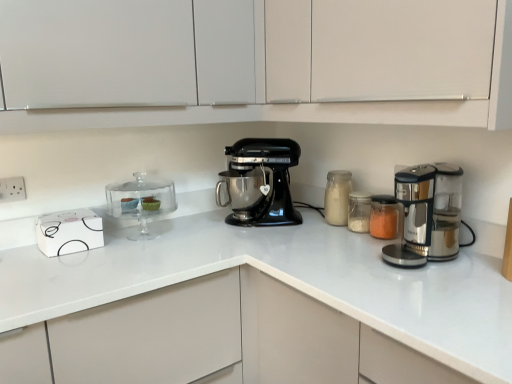
Identify the location of translucent glass jar at center, placed as the 1th appliance when sorted from right to left. (384, 217).

This screenshot has width=512, height=384. Find the location of `black matte mixer at center`. black matte mixer at center is located at coordinates (266, 180).

Describe the element at coordinates (266, 180) in the screenshot. The height and width of the screenshot is (384, 512). I see `black matte mixer at center` at that location.

You are a GUI agent. You are given a task and a screenshot of the screen. Output one action in this format:
    pyautogui.click(x=<x>, y=<y>)
    Task: Click on the translucent glass jar at center, acting as the second appliance starting from the left
    The height and width of the screenshot is (384, 512).
    Given the screenshot: What is the action you would take?
    pyautogui.click(x=359, y=212)

How much space does white matte cabinet at upper center, which is the 1th cabinetry in right-to-left order, occupy vertically?

white matte cabinet at upper center, which is the 1th cabinetry in right-to-left order, is 19.12 inches tall.

What are the coordinates of `translucent glass jar at center-right` in the screenshot? It's located at (337, 197).

Is white plastic electric outlet at upper left to the left or to the right of black matte mixer at center in the image?

white plastic electric outlet at upper left is to the left of black matte mixer at center.

From a real-world perspective, does white plastic electric outlet at upper left stand above black matte mixer at center?

Yes, from a real-world perspective, white plastic electric outlet at upper left is above black matte mixer at center.

Is white plastic electric outlet at upper left oriented towards black matte mixer at center?

No, white plastic electric outlet at upper left is not facing towards black matte mixer at center.

From a real-world perspective, which is physically above, translucent glass jar at center, placed as the 1th appliance when sorted from right to left, or translucent glass jar at center-right?

translucent glass jar at center-right.

Choose the correct answer: Is translucent glass jar at center, placed as the 1th appliance when sorted from right to left, inside translucent glass jar at center-right or outside it?

translucent glass jar at center, placed as the 1th appliance when sorted from right to left, is spatially situated outside translucent glass jar at center-right.

Is point (376, 225) positioned behind point (337, 204)?

No, (376, 225) is closer to viewer.

Does black matte mixer at center appear on the right side of translucent glass jar at center, placed as the 1th appliance when sorted from right to left?

No.

Considering the sizes of black matte mixer at center and translucent glass jar at center, which appears as the third appliance when viewed from the left, in the image, is black matte mixer at center wider or thinner than translucent glass jar at center, which appears as the third appliance when viewed from the left,?

black matte mixer at center is wider than translucent glass jar at center, which appears as the third appliance when viewed from the left.

From a real-world perspective, who is located higher, black matte mixer at center or translucent glass jar at center, placed as the 1th appliance when sorted from right to left?

From a 3D spatial view, black matte mixer at center is above.

From the picture: Can you confirm if black matte mixer at center is smaller than translucent glass jar at center, placed as the 1th appliance when sorted from right to left?

No.

Is white matte cabinet at upper center, which is the 1th cabinetry in right-to-left order, inside or outside of clear glass cake stand at left, the 1th appliance from the left?

white matte cabinet at upper center, which is the 1th cabinetry in right-to-left order, cannot be found inside clear glass cake stand at left, the 1th appliance from the left.

Can you confirm if white matte cabinet at upper center, the second cabinetry positioned from the left, is bigger than clear glass cake stand at left, the 3th appliance in the right-to-left sequence?

Correct, white matte cabinet at upper center, the second cabinetry positioned from the left, is larger in size than clear glass cake stand at left, the 3th appliance in the right-to-left sequence.

Based on their positions, is white matte cabinet at upper center, which is the 1th cabinetry in right-to-left order, located to the left or right of clear glass cake stand at left, the 1th appliance from the left?

Based on their positions, white matte cabinet at upper center, which is the 1th cabinetry in right-to-left order, is located to the right of clear glass cake stand at left, the 1th appliance from the left.

From a real-world perspective, is white matte cabinet at upper center, which is the 1th cabinetry in right-to-left order, over clear glass cake stand at left, the 3th appliance in the right-to-left sequence?

Correct, in the physical world, white matte cabinet at upper center, which is the 1th cabinetry in right-to-left order, is higher than clear glass cake stand at left, the 3th appliance in the right-to-left sequence.

Is white matte cabinet at upper center, which appears as the second cabinetry when viewed from the right, wider or thinner than translucent glass jar at center-right?

Clearly, white matte cabinet at upper center, which appears as the second cabinetry when viewed from the right, has more width compared to translucent glass jar at center-right.

Considering the positions of objects white matte cabinet at upper center, which is the first cabinetry in left-to-right order, and translucent glass jar at center-right in the image provided, who is behind, white matte cabinet at upper center, which is the first cabinetry in left-to-right order, or translucent glass jar at center-right?

Positioned behind is translucent glass jar at center-right.

Is white matte cabinet at upper center, which appears as the second cabinetry when viewed from the right, at the left side of translucent glass jar at center-right?

Yes, white matte cabinet at upper center, which appears as the second cabinetry when viewed from the right, is to the left of translucent glass jar at center-right.

Measure the distance from white matte cabinet at upper center, which is the first cabinetry in left-to-right order, to translucent glass jar at center-right.

white matte cabinet at upper center, which is the first cabinetry in left-to-right order, and translucent glass jar at center-right are 37.04 inches apart from each other.

Is white matte cabinet at upper center, which is the 1th cabinetry in right-to-left order, closer to camera compared to white matte cabinet at upper center, which is the first cabinetry in left-to-right order?

Yes, it is.

Looking at this image, from the image's perspective, which one is positioned higher, white matte cabinet at upper center, the second cabinetry positioned from the left, or white matte cabinet at upper center, which appears as the second cabinetry when viewed from the right?

white matte cabinet at upper center, which appears as the second cabinetry when viewed from the right, is shown above in the image.

Is white matte cabinet at upper center, which is the 1th cabinetry in right-to-left order, bigger than white matte cabinet at upper center, which is the first cabinetry in left-to-right order?

Actually, white matte cabinet at upper center, which is the 1th cabinetry in right-to-left order, might be smaller than white matte cabinet at upper center, which is the first cabinetry in left-to-right order.

How different are the orientations of white matte cabinet at upper center, which is the 1th cabinetry in right-to-left order, and white matte cabinet at upper center, which is the first cabinetry in left-to-right order, in degrees?

There is a 0.145-degree angle between the facing directions of white matte cabinet at upper center, which is the 1th cabinetry in right-to-left order, and white matte cabinet at upper center, which is the first cabinetry in left-to-right order.

From a real-world perspective, does clear glass cake stand at left, the 3th appliance in the right-to-left sequence, stand above white matte cabinet at upper center, the second cabinetry positioned from the left?

Actually, clear glass cake stand at left, the 3th appliance in the right-to-left sequence, is physically below white matte cabinet at upper center, the second cabinetry positioned from the left, in the real world.

Does clear glass cake stand at left, the 3th appliance in the right-to-left sequence, come behind white matte cabinet at upper center, the second cabinetry positioned from the left?

Yes, clear glass cake stand at left, the 3th appliance in the right-to-left sequence, is behind white matte cabinet at upper center, the second cabinetry positioned from the left.

Does clear glass cake stand at left, the 1th appliance from the left, appear on the right side of white matte cabinet at upper center, the second cabinetry positioned from the left?

No.

Considering the sizes of objects clear glass cake stand at left, the 1th appliance from the left, and white matte cabinet at upper center, the second cabinetry positioned from the left, in the image provided, who is bigger, clear glass cake stand at left, the 1th appliance from the left, or white matte cabinet at upper center, the second cabinetry positioned from the left,?

white matte cabinet at upper center, the second cabinetry positioned from the left.

This screenshot has width=512, height=384. What are the coordinates of `mixer located underneath the white plastic electric outlet at upper left (from a real-world perspective)` in the screenshot? It's located at (266, 180).

I want to click on appliance that is the 2nd one when counting rightward from the translucent glass jar at center-right, so click(384, 217).

Estimate the real-world distances between objects in this image. Which object is further from white matte cabinet at upper center, which appears as the second cabinetry when viewed from the right, black matte mixer at center or translucent glass jar at center-right?

translucent glass jar at center-right.

From the image, which object appears to be farther from white plastic electric outlet at upper left, translucent glass jar at center, placed as the second appliance when sorted from right to left, or white matte cabinet at upper center, which is the first cabinetry in left-to-right order?

The object further to white plastic electric outlet at upper left is translucent glass jar at center, placed as the second appliance when sorted from right to left.

Looking at the image, which one is located further to white matte cabinet at upper center, which appears as the second cabinetry when viewed from the right, clear glass cake stand at left, the 1th appliance from the left, or translucent glass jar at center, acting as the second appliance starting from the left?

translucent glass jar at center, acting as the second appliance starting from the left, lies further to white matte cabinet at upper center, which appears as the second cabinetry when viewed from the right, than the other object.

When comparing their distances from translucent glass jar at center, which appears as the third appliance when viewed from the left, does translucent glass jar at center-right or translucent glass jar at center, placed as the second appliance when sorted from right to left, seem further?

A: Among the two, translucent glass jar at center-right is located further to translucent glass jar at center, which appears as the third appliance when viewed from the left.

Considering their positions, is white plastic electric outlet at upper left positioned further to translucent glass jar at center-right than black matte mixer at center?

white plastic electric outlet at upper left is further to translucent glass jar at center-right.

Looking at the image, which one is located further to clear glass cake stand at left, the 1th appliance from the left, white plastic electric outlet at upper left or white matte cabinet at upper center, which is the 1th cabinetry in right-to-left order?

white matte cabinet at upper center, which is the 1th cabinetry in right-to-left order, is positioned further to the anchor clear glass cake stand at left, the 1th appliance from the left.

Consider the image. Based on their spatial positions, is black matte mixer at center or translucent glass jar at center, placed as the second appliance when sorted from right to left, further from translucent glass jar at center, which appears as the third appliance when viewed from the left?

black matte mixer at center.

Based on their spatial positions, is white matte cabinet at upper center, which is the first cabinetry in left-to-right order, or translucent glass jar at center, acting as the second appliance starting from the left, further from black matte mixer at center?

white matte cabinet at upper center, which is the first cabinetry in left-to-right order.

Where is `cabinetry between white plastic electric outlet at upper left and translucent glass jar at center, acting as the second appliance starting from the left`? cabinetry between white plastic electric outlet at upper left and translucent glass jar at center, acting as the second appliance starting from the left is located at coordinates (97, 52).

You are a GUI agent. You are given a task and a screenshot of the screen. Output one action in this format:
    pyautogui.click(x=<x>, y=<y>)
    Task: Click on the cabinetry located between white plastic electric outlet at upper left and translucent glass jar at center-right in the left-right direction
    This screenshot has width=512, height=384.
    Given the screenshot: What is the action you would take?
    pyautogui.click(x=97, y=52)

This screenshot has height=384, width=512. In order to click on bottle between clear glass cake stand at left, the 1th appliance from the left, and translucent glass jar at center, placed as the 1th appliance when sorted from right to left in this screenshot , I will do [x=337, y=197].

The image size is (512, 384). I want to click on bottle between white plastic electric outlet at upper left and translucent glass jar at center, acting as the second appliance starting from the left, from left to right, so click(x=337, y=197).